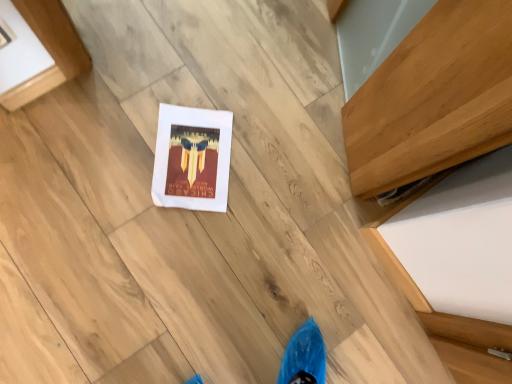
Where is `vacant area that is situated to the right of white paper at center`? The height and width of the screenshot is (384, 512). vacant area that is situated to the right of white paper at center is located at coordinates (258, 206).